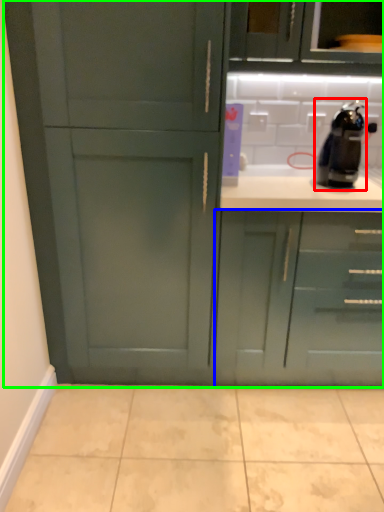
Question: Based on their relative distances, which object is nearer to coffee machine (highlighted by a red box)? Choose from cabinetry (highlighted by a blue box) and cabinetry (highlighted by a green box).

Choices:
 (A) cabinetry
 (B) cabinetry

Answer: (A)